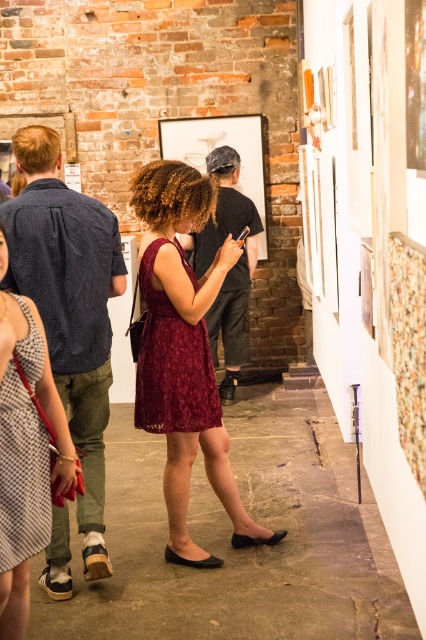
Question: Is burgundy lace dress at center further to camera compared to checkered fabric dress at center?

Choices:
 (A) yes
 (B) no

Answer: (A)

Question: Does burgundy lace dress at center have a lesser width compared to checkered fabric dress at center?

Choices:
 (A) no
 (B) yes

Answer: (A)

Question: Which point appears closest to the camera in this image?

Choices:
 (A) (5, 385)
 (B) (154, 209)

Answer: (A)

Question: Is burgundy lace dress at center bigger than checkered fabric dress at center?

Choices:
 (A) yes
 (B) no

Answer: (A)

Question: Which object is closer to the camera taking this photo?

Choices:
 (A) burgundy lace dress at center
 (B) checkered fabric dress at center

Answer: (B)